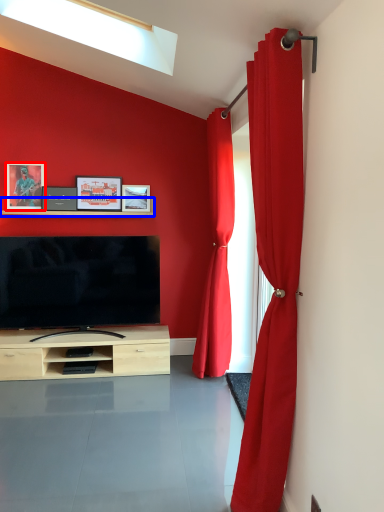
Question: Which of the following is the farthest to the observer, picture frame (highlighted by a red box) or shelf (highlighted by a blue box)?

Choices:
 (A) picture frame
 (B) shelf

Answer: (A)